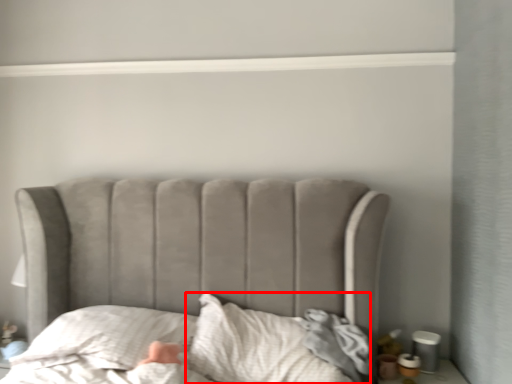
Question: From the image's perspective, considering the relative positions of sheet (annotated by the red box) and throw pillow in the image provided, where is sheet (annotated by the red box) located with respect to the staircase?

Choices:
 (A) above
 (B) below

Answer: (B)